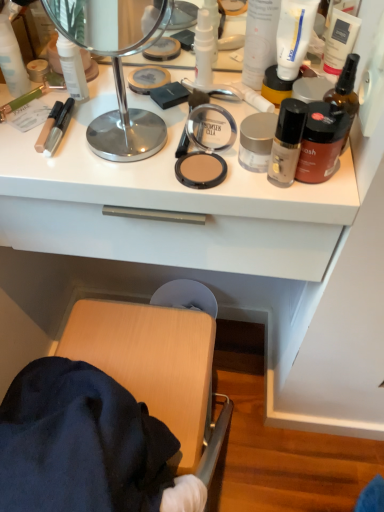
What do you see at coordinates (48, 126) in the screenshot? I see `matte black concealer at left, which ranks as the ninth toiletry in right-to-left order` at bounding box center [48, 126].

Describe the element at coordinates (12, 60) in the screenshot. Image resolution: width=384 pixels, height=512 pixels. I see `matte white lotion at upper left, which is counted as the tenth toiletry, starting from the right` at that location.

The image size is (384, 512). What are the coordinates of `satin silver jar at upper center, the seventh toiletry positioned from the right` in the screenshot? It's located at (256, 141).

Locate an element on the screen. white matte tube at upper right, which is the third toiletry in right-to-left order is located at coordinates (294, 35).

From the image's perspective, between matte black foundation at upper right, which is the 5th toiletry in right-to-left order, and matte brown compact at center, which one is located above?

matte black foundation at upper right, which is the 5th toiletry in right-to-left order.

Which is behind, matte black foundation at upper right, which is the 5th toiletry in right-to-left order, or matte brown compact at center?

matte brown compact at center is further from the camera.

Which object is thinner, matte black foundation at upper right, the sixth toiletry from the left, or matte brown compact at center?

matte black foundation at upper right, the sixth toiletry from the left.

In the scene shown: Is matte black foundation at upper right, the sixth toiletry from the left, turned away from matte brown compact at center?

No, matte black foundation at upper right, the sixth toiletry from the left, is not facing the opposite direction of matte brown compact at center.

Which is behind, point (21, 415) or point (299, 127)?

The point (21, 415) is farther.

Which toiletry is the 4th one when counting from the right side of the wooden stool at lower left? Please provide its 2D coordinates.

[(287, 142)]

Considering the sizes of objects wooden stool at lower left and matte black foundation at upper right, which is the 5th toiletry in right-to-left order, in the image provided, who is wider, wooden stool at lower left or matte black foundation at upper right, which is the 5th toiletry in right-to-left order,?

wooden stool at lower left.

From the image's perspective, which is below, matte black concealer at left, which is the 2th toiletry from left to right, or wooden stool at lower left?

wooden stool at lower left.

What's the angular difference between matte black concealer at left, which is the 2th toiletry from left to right, and wooden stool at lower left's facing directions?

They differ by 180 degrees in their facing directions.

Could you tell me if matte black concealer at left, which is the 2th toiletry from left to right, is turned towards wooden stool at lower left?

No, matte black concealer at left, which is the 2th toiletry from left to right, does not turn towards wooden stool at lower left.

From the picture: Is matte black concealer at left, which is the 2th toiletry from left to right, placed right next to wooden stool at lower left?

No, matte black concealer at left, which is the 2th toiletry from left to right, is not with wooden stool at lower left.

In the scene shown: Which object is further away from the camera, white matte spray bottle at center, which appears as the third toiletry when viewed from the left, or white matte lotion at upper right, the fifth toiletry positioned from the left?

white matte spray bottle at center, which appears as the third toiletry when viewed from the left, is more distant.

Is white matte spray bottle at center, which appears as the third toiletry when viewed from the left, next to white matte lotion at upper right, the fifth toiletry positioned from the left?

Yes, white matte spray bottle at center, which appears as the third toiletry when viewed from the left, and white matte lotion at upper right, the fifth toiletry positioned from the left, clearly make contact.

Who is bigger, white matte spray bottle at center, which appears as the third toiletry when viewed from the left, or white matte lotion at upper right, the fifth toiletry positioned from the left?

white matte lotion at upper right, the fifth toiletry positioned from the left.

From a real-world perspective, between white matte spray bottle at center, which appears as the third toiletry when viewed from the left, and white matte lotion at upper right, positioned as the 6th toiletry in right-to-left order, who is vertically lower?

In real-world perspective, white matte spray bottle at center, which appears as the third toiletry when viewed from the left, is lower.

From the image's perspective, is white matte tube at upper right, which is the third toiletry in right-to-left order, located above or below brown glass spray bottle at upper right, which is counted as the first toiletry, starting from the right?

From the image's perspective, white matte tube at upper right, which is the third toiletry in right-to-left order, appears above brown glass spray bottle at upper right, which is counted as the first toiletry, starting from the right.

From a real-world perspective, does white matte tube at upper right, placed as the eighth toiletry when sorted from left to right, sit lower than brown glass spray bottle at upper right, which is counted as the first toiletry, starting from the right?

No, from a real-world perspective, white matte tube at upper right, placed as the eighth toiletry when sorted from left to right, is not beneath brown glass spray bottle at upper right, which is counted as the first toiletry, starting from the right.

Can you see white matte tube at upper right, which is the third toiletry in right-to-left order, touching brown glass spray bottle at upper right, which is the 10th toiletry in left-to-right order?

No, white matte tube at upper right, which is the third toiletry in right-to-left order, is not in contact with brown glass spray bottle at upper right, which is the 10th toiletry in left-to-right order.

Is white matte tube at upper right, placed as the eighth toiletry when sorted from left to right, positioned in front of brown glass spray bottle at upper right, which is the 10th toiletry in left-to-right order?

No.

Locate an element on the screen. The width and height of the screenshot is (384, 512). the 2nd toiletry above when counting from the matte black foundation at upper right, the sixth toiletry from the left (from the image's perspective) is located at coordinates (256, 141).

Which object is further away from the camera taking this photo, matte black foundation at upper right, which is the 5th toiletry in right-to-left order, or satin silver jar at upper center, the seventh toiletry positioned from the right?

satin silver jar at upper center, the seventh toiletry positioned from the right, is behind.

From the image's perspective, between matte black foundation at upper right, which is the 5th toiletry in right-to-left order, and satin silver jar at upper center, which is the 4th toiletry from left to right, which one is located above?

From the image's view, satin silver jar at upper center, which is the 4th toiletry from left to right, is above.

Are matte black foundation at upper right, the sixth toiletry from the left, and satin silver jar at upper center, which is the 4th toiletry from left to right, making contact?

Yes, matte black foundation at upper right, the sixth toiletry from the left, is in contact with satin silver jar at upper center, which is the 4th toiletry from left to right.

From the image's perspective, who appears lower, wooden stool at lower left or white matte lotion at upper right, the fifth toiletry positioned from the left?

wooden stool at lower left.

Considering the sizes of objects wooden stool at lower left and white matte lotion at upper right, the fifth toiletry positioned from the left, in the image provided, who is smaller, wooden stool at lower left or white matte lotion at upper right, the fifth toiletry positioned from the left,?

Smaller between the two is white matte lotion at upper right, the fifth toiletry positioned from the left.

Which is less distant, (86, 315) or (247, 57)?

Clearly, point (86, 315) is more distant from the camera than point (247, 57).

There is a matte brown compact at center. Find the location of `the 1st toiletry above it (from the image's perspective)`. the 1st toiletry above it (from the image's perspective) is located at coordinates (287, 142).

In order to click on furniture in front of the matte black foundation at upper right, the sixth toiletry from the left in this screenshot , I will do `click(107, 411)`.

Based on their spatial positions, is matte brown compact at center or brown glass spray bottle at upper right, which is counted as the first toiletry, starting from the right, closer to satin silver jar at upper center, which is the 4th toiletry from left to right?

Among the two, matte brown compact at center is located nearer to satin silver jar at upper center, which is the 4th toiletry from left to right.

Based on their spatial positions, is matte brown compact at center or satin silver jar at upper center, the seventh toiletry positioned from the right, closer to matte white lotion at upper left, the 1th toiletry in the left-to-right sequence?

matte brown compact at center.

Estimate the real-world distances between objects in this image. Which object is closer to matte black foundation at upper right, the sixth toiletry from the left, yellow matte jar at upper right, which ranks as the seventh toiletry in left-to-right order, or matte black concealer at left, which is the 2th toiletry from left to right?

yellow matte jar at upper right, which ranks as the seventh toiletry in left-to-right order.

From the picture: Estimate the real-world distances between objects in this image. Which object is further from white matte tube at upper right, placed as the eighth toiletry when sorted from left to right, brown glass spray bottle at upper right, which is the 10th toiletry in left-to-right order, or satin silver jar at upper center, which is the 4th toiletry from left to right?

satin silver jar at upper center, which is the 4th toiletry from left to right.

Which object lies further to the anchor point matte black concealer at left, which is the 2th toiletry from left to right, matte white lotion at upper left, the 1th toiletry in the left-to-right sequence, or matte brown compact at center?

matte brown compact at center is further to matte black concealer at left, which is the 2th toiletry from left to right.

Based on their spatial positions, is wooden stool at lower left or white matte spray bottle at center, the 8th toiletry from the right, further from yellow matte jar at upper right, the 4th toiletry from the right?

wooden stool at lower left is further to yellow matte jar at upper right, the 4th toiletry from the right.

Looking at the image, which one is located closer to white matte tube at upper right, which is the third toiletry in right-to-left order, matte brown compact at center or white matte countertop at upper center?

matte brown compact at center.

Estimate the real-world distances between objects in this image. Which object is closer to white matte lotion at upper right, the fifth toiletry positioned from the left, white matte countertop at upper center or matte brown bottle at upper right, the second toiletry when ordered from right to left?

Among the two, matte brown bottle at upper right, the second toiletry when ordered from right to left, is located nearer to white matte lotion at upper right, the fifth toiletry positioned from the left.

Find the location of a particular element. counter top located between polished silver mirror at upper center and matte brown bottle at upper right, the second toiletry when ordered from right to left, in the left-right direction is located at coordinates (166, 202).

You are a GUI agent. You are given a task and a screenshot of the screen. Output one action in this format:
    pyautogui.click(x=<x>, y=<y>)
    Task: Click on the mirror that lies between white matte lotion at upper right, the fifth toiletry positioned from the left, and wooden stool at lower left from top to bottom
    This screenshot has width=384, height=512.
    Given the screenshot: What is the action you would take?
    pyautogui.click(x=115, y=69)

Locate an element on the screen. The width and height of the screenshot is (384, 512). face powder located between polished silver mirror at upper center and white matte spray bottle at center, which appears as the third toiletry when viewed from the left, in the depth direction is located at coordinates (200, 170).

Identify the location of mirror between matte white lotion at upper left, which is counted as the tenth toiletry, starting from the right, and white matte tube at upper right, placed as the eighth toiletry when sorted from left to right. (115, 69).